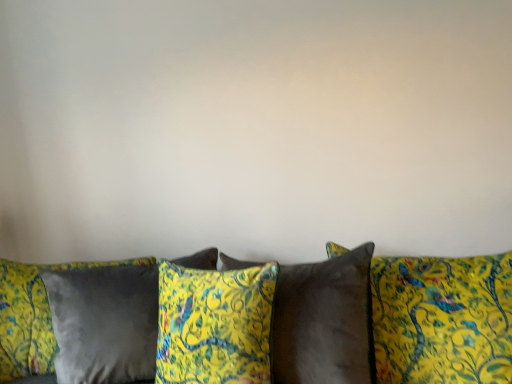
Question: From the image's perspective, is satin brown pillow at center, which appears as the 1th pillow when viewed from the right, below velvet yellow pillow at center, which ranks as the 2th pillow in left-to-right order?

Choices:
 (A) yes
 (B) no

Answer: (B)

Question: From a real-world perspective, is satin brown pillow at center, which appears as the 1th pillow when viewed from the right, physically below velvet yellow pillow at center, which ranks as the 3th pillow in right-to-left order?

Choices:
 (A) yes
 (B) no

Answer: (A)

Question: Considering the relative sizes of satin brown pillow at center, the 4th pillow positioned from the left, and velvet yellow pillow at center, which ranks as the 3th pillow in right-to-left order, in the image provided, is satin brown pillow at center, the 4th pillow positioned from the left, taller than velvet yellow pillow at center, which ranks as the 3th pillow in right-to-left order,?

Choices:
 (A) no
 (B) yes

Answer: (B)

Question: From a real-world perspective, does satin brown pillow at center, the 4th pillow positioned from the left, stand above velvet yellow pillow at center, which ranks as the 2th pillow in left-to-right order?

Choices:
 (A) yes
 (B) no

Answer: (B)

Question: Does satin brown pillow at center, the 4th pillow positioned from the left, lie behind velvet yellow pillow at center, which ranks as the 2th pillow in left-to-right order?

Choices:
 (A) no
 (B) yes

Answer: (A)

Question: Is satin brown pillow at center, the 4th pillow positioned from the left, far from velvet yellow pillow at center, which ranks as the 3th pillow in right-to-left order?

Choices:
 (A) yes
 (B) no

Answer: (B)

Question: Can you confirm if satin gray pillow at lower left, the 4th pillow positioned from the right, is smaller than velvet yellow pillow at center, which ranks as the 3th pillow in left-to-right order?

Choices:
 (A) no
 (B) yes

Answer: (A)

Question: Does satin gray pillow at lower left, the 4th pillow positioned from the right, have a lesser height compared to velvet yellow pillow at center, positioned as the second pillow in right-to-left order?

Choices:
 (A) no
 (B) yes

Answer: (A)

Question: Is velvet yellow pillow at center, positioned as the second pillow in right-to-left order, completely or partially inside satin gray pillow at lower left, the 4th pillow positioned from the right?

Choices:
 (A) yes
 (B) no

Answer: (B)

Question: Considering the relative sizes of satin gray pillow at lower left, the first pillow viewed from the left, and velvet yellow pillow at center, positioned as the second pillow in right-to-left order, in the image provided, is satin gray pillow at lower left, the first pillow viewed from the left, taller than velvet yellow pillow at center, positioned as the second pillow in right-to-left order,?

Choices:
 (A) no
 (B) yes

Answer: (B)

Question: Would you say satin gray pillow at lower left, the 4th pillow positioned from the right, is a long distance from velvet yellow pillow at center, positioned as the second pillow in right-to-left order?

Choices:
 (A) no
 (B) yes

Answer: (A)

Question: Can you confirm if satin gray pillow at lower left, the first pillow viewed from the left, is thinner than velvet yellow pillow at center, positioned as the second pillow in right-to-left order?

Choices:
 (A) yes
 (B) no

Answer: (B)

Question: Does satin brown pillow at center, the 4th pillow positioned from the left, have a lesser height compared to velvet yellow pillow at center, positioned as the second pillow in right-to-left order?

Choices:
 (A) yes
 (B) no

Answer: (B)